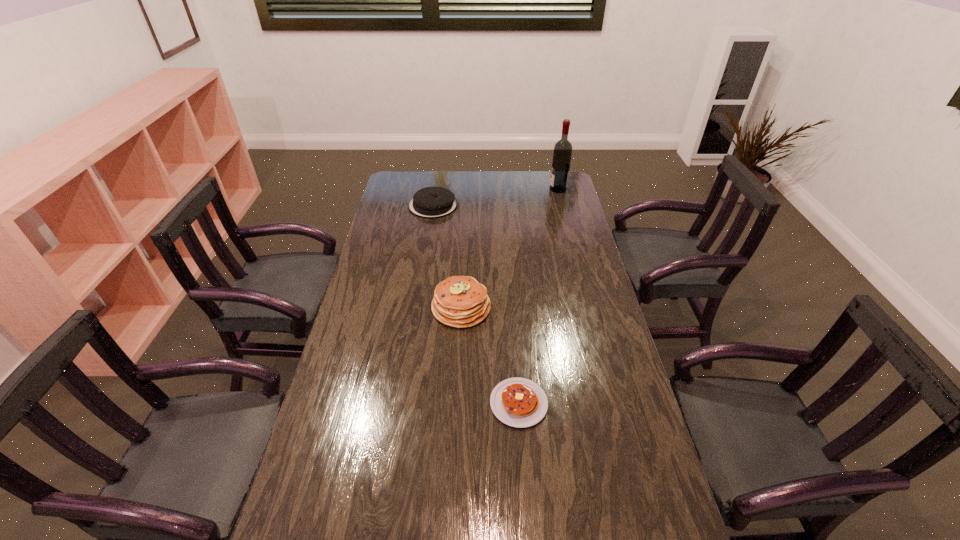
What are the coordinates of `free region that satisfies the following two spatial constraints: 1. on the front side of the second tallest pancake; 2. on the right side of the nearest pancake` in the screenshot? It's located at (403, 403).